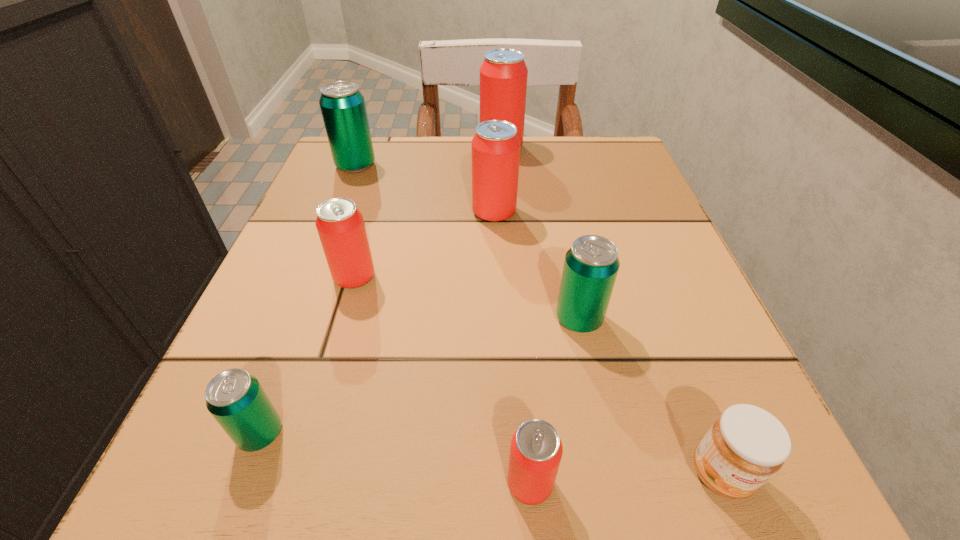
This screenshot has width=960, height=540. I want to click on the nearest teal beer can, so click(235, 398).

At what (x,y) coordinates should I click in order to perform the action: click on the nearest red beer can. Please return your answer as a coordinate pair (x, y). Looking at the image, I should click on tap(536, 449).

Where is `the nearest beer can`? The width and height of the screenshot is (960, 540). the nearest beer can is located at coordinates (536, 449).

The height and width of the screenshot is (540, 960). I want to click on orange jam, so click(746, 445).

Where is `jam`? The width and height of the screenshot is (960, 540). jam is located at coordinates point(746,445).

Locate an element on the screen. This screenshot has height=540, width=960. free space located 0.390m on the front of the farthest red beer can is located at coordinates (511, 283).

You are a GUI agent. You are given a task and a screenshot of the screen. Output one action in this format:
    pyautogui.click(x=<x>, y=<y>)
    Task: Click on the vacant space located on the right of the farthest teal beer can
    Image resolution: width=960 pixels, height=540 pixels.
    Given the screenshot: What is the action you would take?
    pyautogui.click(x=544, y=166)

At what (x,y) coordinates should I click in order to perform the action: click on free space located 0.230m on the back of the second farthest red beer can. Please return your answer as a coordinate pair (x, y). Looking at the image, I should click on (492, 143).

This screenshot has width=960, height=540. What are the coordinates of `vacant space located 0.120m on the back of the fourth farthest beer can` in the screenshot? It's located at (372, 220).

Identify the location of vacant space situated on the back of the second farthest teal beer can. (558, 221).